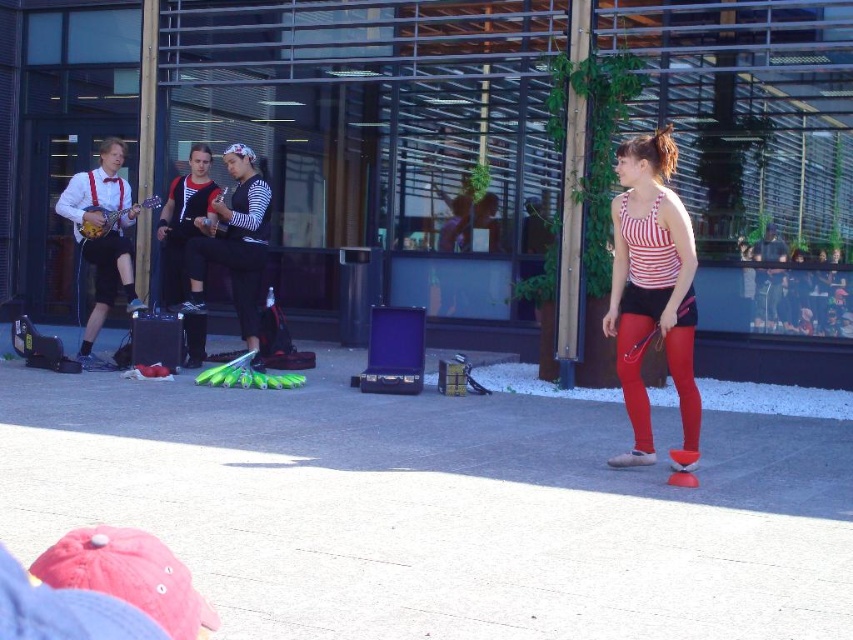
Question: Which is nearer to the striped fabric top at center?

Choices:
 (A) smooth concrete pavement at center
 (B) red matte leggings at center

Answer: (B)

Question: Which point is closer to the camera?

Choices:
 (A) red matte leggings at center
 (B) striped fabric tank top at center
 (C) matte red suspenders at left

Answer: (B)

Question: Which point is closer to the camera?

Choices:
 (A) (193, 340)
 (B) (688, 432)
 (C) (602, 440)
 (D) (93, 252)

Answer: (B)

Question: Is striped fabric tank top at center below red matte leggings at center?

Choices:
 (A) yes
 (B) no

Answer: (B)

Question: Can you confirm if striped fabric top at center is positioned below matte red suspenders at left?

Choices:
 (A) yes
 (B) no

Answer: (A)

Question: Does striped fabric tank top at center lie in front of striped fabric top at center?

Choices:
 (A) yes
 (B) no

Answer: (A)